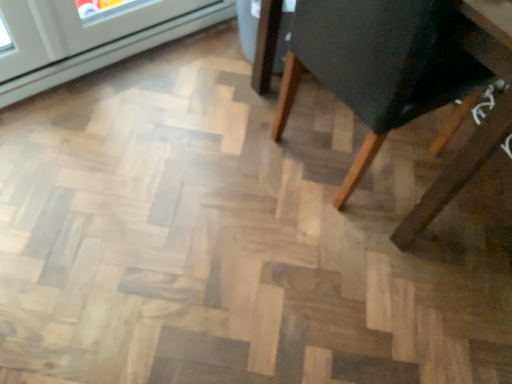
Find the location of a particular element. The width and height of the screenshot is (512, 384). black matte chair at upper right is located at coordinates (388, 63).

The width and height of the screenshot is (512, 384). Describe the element at coordinates (388, 63) in the screenshot. I see `black matte chair at upper right` at that location.

Image resolution: width=512 pixels, height=384 pixels. Find the location of `black matte chair at upper right`. black matte chair at upper right is located at coordinates (388, 63).